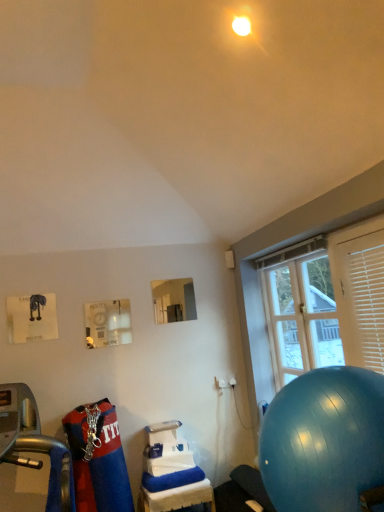
Locate an element on the screen. The height and width of the screenshot is (512, 384). clear glass window at right is located at coordinates (347, 278).

What is the approximate width of clear glass window at right?

The width of clear glass window at right is 5.42 inches.

Find the location of a particular element. This screenshot has width=384, height=512. white plastic table at lower center is located at coordinates (177, 497).

Could you tell me if clear glass window at right is turned towards white plastic blinds at right?

No, clear glass window at right is not oriented towards white plastic blinds at right.

Consider the image. Considering the sizes of objects clear glass window at right and white plastic blinds at right in the image provided, who is smaller, clear glass window at right or white plastic blinds at right?

white plastic blinds at right is smaller.

Is clear glass window at right completely or partially outside of white plastic blinds at right?

That's correct, clear glass window at right is outside of white plastic blinds at right.

From the image's perspective, which one is positioned higher, white plastic table at lower center or white plastic blinds at right?

white plastic blinds at right appears higher in the image.

Which object is wider, white plastic table at lower center or white plastic blinds at right?

Wider between the two is white plastic table at lower center.

Can you tell me how much white plastic table at lower center and white plastic blinds at right differ in facing direction?

The angular difference between white plastic table at lower center and white plastic blinds at right is 91.2 degrees.

Which object is positioned more to the right, blue rubber ball at lower right or white plastic blinds at right?

From the viewer's perspective, white plastic blinds at right appears more on the right side.

Does point (344, 418) appear closer or farther from the camera than point (383, 311)?

Clearly, point (344, 418) is closer to the camera than point (383, 311).

Is blue rubber ball at lower right facing towards white plastic blinds at right?

No, blue rubber ball at lower right is not aimed at white plastic blinds at right.

Considering the positions of objects white plastic blinds at right and blue rubber ball at lower right in the image provided, who is in front, white plastic blinds at right or blue rubber ball at lower right?

blue rubber ball at lower right is closer to the camera.

Can you see white plastic blinds at right touching blue rubber ball at lower right?

No, white plastic blinds at right is not in contact with blue rubber ball at lower right.

Which object is positioned more to the left, white plastic blinds at right or blue rubber ball at lower right?

blue rubber ball at lower right is more to the left.

Can blue rubber ball at lower right be found inside white plastic blinds at right?

That's incorrect, blue rubber ball at lower right is not inside white plastic blinds at right.

How much distance is there between blue rubber ball at lower right and white plastic table at lower center?

A distance of 1.44 meters exists between blue rubber ball at lower right and white plastic table at lower center.

Is blue rubber ball at lower right bigger than white plastic table at lower center?

Yes.

From a real-world perspective, who is located higher, blue rubber ball at lower right or white plastic table at lower center?

blue rubber ball at lower right.

Is blue rubber ball at lower right positioned with its back to white plastic table at lower center?

That's not correct — blue rubber ball at lower right is not looking away from white plastic table at lower center.

Is blue rubber ball at lower right a part of clear glass window at right?

Actually, blue rubber ball at lower right is outside clear glass window at right.

Is clear glass window at right next to blue rubber ball at lower right?

No.

From a real-world perspective, between clear glass window at right and blue rubber ball at lower right, who is vertically lower?

In real-world perspective, blue rubber ball at lower right is lower.

From the image's perspective, who appears lower, white plastic table at lower center or blue rubber ball at lower right?

white plastic table at lower center.

Where is `ball to the right of white plastic table at lower center`? ball to the right of white plastic table at lower center is located at coordinates pyautogui.click(x=324, y=440).

Considering the sizes of objects white plastic table at lower center and blue rubber ball at lower right in the image provided, who is shorter, white plastic table at lower center or blue rubber ball at lower right?

white plastic table at lower center is shorter.

Is white plastic table at lower center inside the boundaries of blue rubber ball at lower right, or outside?

white plastic table at lower center is not enclosed by blue rubber ball at lower right.

The height and width of the screenshot is (512, 384). Find the location of `window on the left of white plastic blinds at right`. window on the left of white plastic blinds at right is located at coordinates (347, 278).

You are a GUI agent. You are given a task and a screenshot of the screen. Output one action in this format:
    pyautogui.click(x=<x>, y=<y>)
    Task: Click on the shutter above the white plastic table at lower center (from a real-world perspective)
    
    Given the screenshot: What is the action you would take?
    pyautogui.click(x=368, y=303)

From the image, which object appears to be nearer to clear glass window at right, white plastic table at lower center or white plastic blinds at right?

white plastic blinds at right lies closer to clear glass window at right than the other object.

When comparing their distances from clear glass window at right, does white plastic blinds at right or white plastic table at lower center seem further?

Among the two, white plastic table at lower center is located further to clear glass window at right.

From the picture: Based on their spatial positions, is white plastic blinds at right or white plastic table at lower center further from blue rubber ball at lower right?

white plastic table at lower center.

Which object lies further to the anchor point blue rubber ball at lower right, clear glass window at right or white plastic blinds at right?

Based on the image, clear glass window at right appears to be further to blue rubber ball at lower right.

Which object lies nearer to the anchor point white plastic blinds at right, white plastic table at lower center or blue rubber ball at lower right?

Based on the image, blue rubber ball at lower right appears to be nearer to white plastic blinds at right.

When comparing their distances from white plastic table at lower center, does white plastic blinds at right or blue rubber ball at lower right seem further?

white plastic blinds at right is positioned further to the anchor white plastic table at lower center.

When comparing their distances from white plastic table at lower center, does clear glass window at right or blue rubber ball at lower right seem further?

blue rubber ball at lower right.

Based on their spatial positions, is clear glass window at right or blue rubber ball at lower right further from white plastic blinds at right?

Based on the image, blue rubber ball at lower right appears to be further to white plastic blinds at right.

You are a GUI agent. You are given a task and a screenshot of the screen. Output one action in this format:
    pyautogui.click(x=<x>, y=<y>)
    Task: Click on the window between blue rubber ball at lower right and white plastic table at lower center along the z-axis
    This screenshot has height=512, width=384.
    Given the screenshot: What is the action you would take?
    347,278

You are a GUI agent. You are given a task and a screenshot of the screen. Output one action in this format:
    pyautogui.click(x=<x>, y=<y>)
    Task: Click on the shutter between blue rubber ball at lower right and clear glass window at right from front to back
    
    Given the screenshot: What is the action you would take?
    pyautogui.click(x=368, y=303)

Where is `window that lies between white plastic blinds at right and white plastic table at lower center from top to bottom`? window that lies between white plastic blinds at right and white plastic table at lower center from top to bottom is located at coordinates (347, 278).

Image resolution: width=384 pixels, height=512 pixels. In order to click on ball that lies between white plastic blinds at right and white plastic table at lower center from top to bottom in this screenshot , I will do `click(324, 440)`.